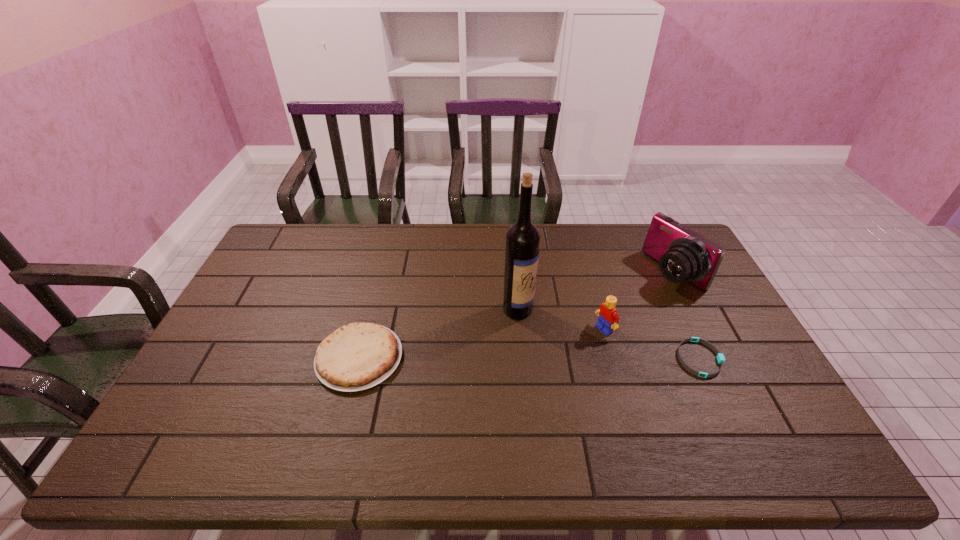
Where is `vacant space at the near right corner of the desktop`? The width and height of the screenshot is (960, 540). vacant space at the near right corner of the desktop is located at coordinates tap(781, 405).

In order to click on blank region between the shortest object and the leftmost object in this screenshot , I will do `click(530, 358)`.

Identify the location of blank region between the shortest object and the third object from right to left. This screenshot has width=960, height=540. (652, 344).

Find the location of a particular element. vacant area that lies between the farthest object and the Lego is located at coordinates (639, 301).

Locate an element on the screen. free space between the Lego and the fourth shortest object is located at coordinates (639, 301).

The height and width of the screenshot is (540, 960). I want to click on vacant area that lies between the tortilla and the Lego, so click(x=482, y=343).

You are a GUI agent. You are given a task and a screenshot of the screen. Output one action in this format:
    pyautogui.click(x=<x>, y=<y>)
    Task: Click on the free area in between the farthest object and the Lego
    Image resolution: width=960 pixels, height=540 pixels.
    Given the screenshot: What is the action you would take?
    pyautogui.click(x=639, y=301)

The height and width of the screenshot is (540, 960). I want to click on free space between the Lego and the fourth object from right to left, so click(561, 320).

Choose which object is the third nearest neighbor to the second shortest object. Please provide its 2D coordinates. Your answer should be formatted as a tuple, i.e. [(x, y)], where the tuple contains the x and y coordinates of a point satisfying the conditions above.

[(720, 357)]

Find the location of a particular element. The height and width of the screenshot is (540, 960). object that is the third closest one to the fourth shortest object is located at coordinates (522, 238).